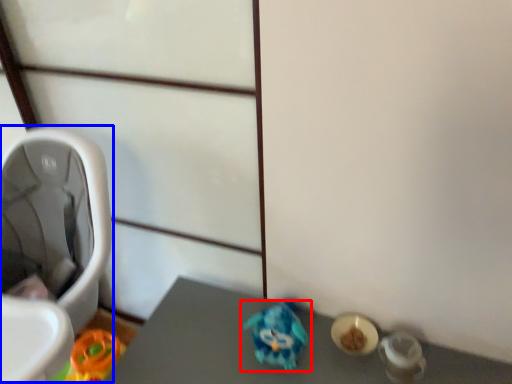
Question: Which point is further to the camera, toy (highlighted by a red box) or baby carriage (highlighted by a blue box)?

Choices:
 (A) toy
 (B) baby carriage

Answer: (A)